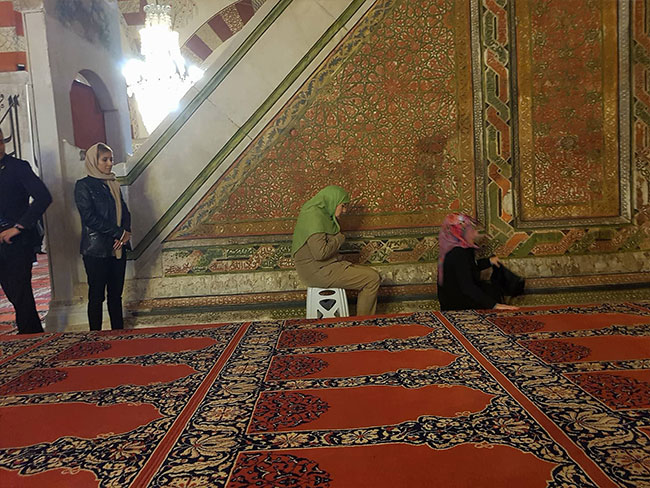
Where is `white stool`? white stool is located at coordinates (343, 298).